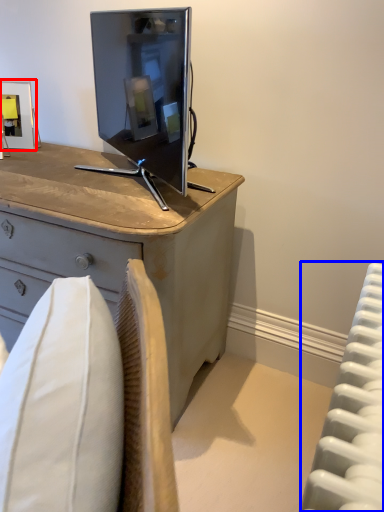
Question: Which of the following is the closest to the observer, picture frame (highlighted by a red box) or radiator (highlighted by a blue box)?

Choices:
 (A) picture frame
 (B) radiator

Answer: (B)